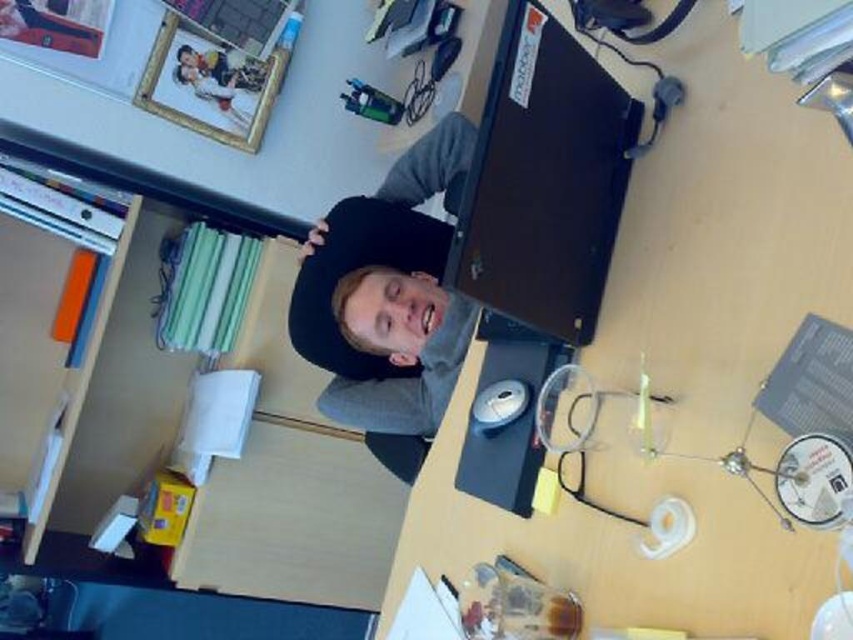
Question: Which point is closer to the camera?

Choices:
 (A) black matte cap at center
 (B) matte black laptop at upper center
 (C) black matte laptop at upper center

Answer: (B)

Question: Which object appears closest to the camera in this image?

Choices:
 (A) black matte laptop at upper center
 (B) matte black laptop at upper center
 (C) black matte cap at center

Answer: (B)

Question: Does black matte laptop at upper center appear on the right side of black matte cap at center?

Choices:
 (A) no
 (B) yes

Answer: (B)

Question: Which of the following is the farthest from the observer?

Choices:
 (A) matte black laptop at upper center
 (B) black matte cap at center

Answer: (B)

Question: In this image, where is black matte laptop at upper center located relative to black matte cap at center?

Choices:
 (A) above
 (B) below

Answer: (A)

Question: Does matte black laptop at upper center have a smaller size compared to black matte laptop at upper center?

Choices:
 (A) no
 (B) yes

Answer: (A)